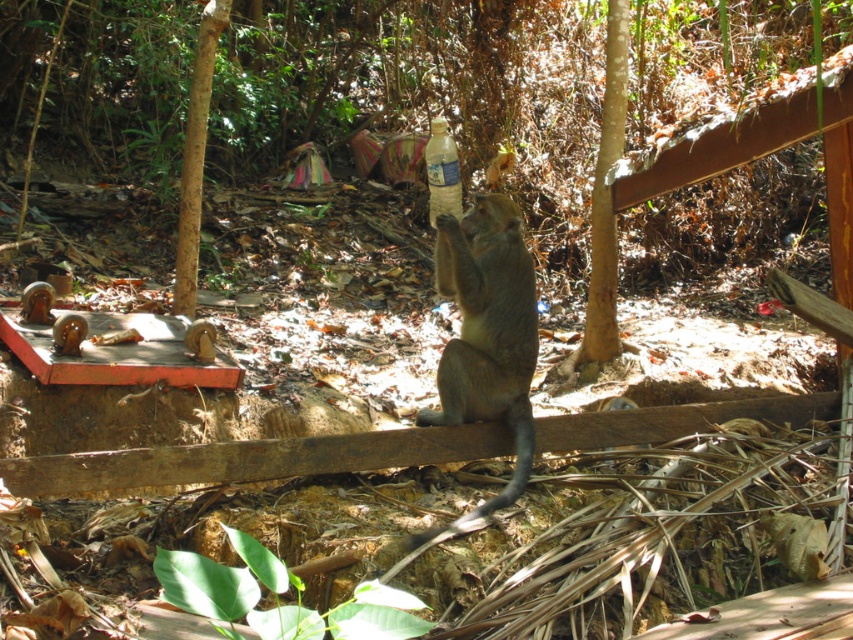
You are standing in the forest and want to move from the point at coordinates point (614, 100) to the point at coordinates point (183, 285). Which direction should you move to get closer to the destination?

You should move downward and to the right because point (183, 285) is located lower and to the right of point (614, 100) in the image.

You are navigating through a forest and see two points marked in the scene. The first point is at coordinates point (483,320) and the second is at point (624,17). Which point is closer to you?

Point (483,320) is in front of point (624,17), so it is closer to you.

You are a hiker who wants to take a photo of the brown furry monkey at center and the brown rough bark tree at center. Which object is closer to the left side of your camera frame?

The brown furry monkey at center is positioned on the left side of the brown rough bark tree at center, so it is closer to the left side of the camera frame.